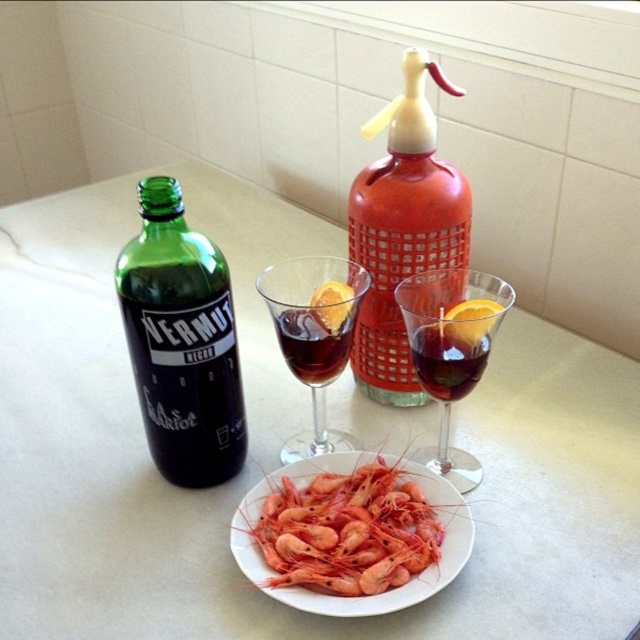
Between white glossy table at center and dark red glass at center, which one appears on the left side from the viewer's perspective?

Positioned to the left is white glossy table at center.

At what (x,y) coordinates should I click in order to perform the action: click on white glossy table at center. Please return your answer as a coordinate pair (x, y). This screenshot has height=640, width=640. Looking at the image, I should click on (278, 451).

The image size is (640, 640). Identify the location of white glossy table at center. (278, 451).

Does green glass bottle at left lie in front of dark red glass at center?

Yes.

Does green glass bottle at left have a greater width compared to dark red glass at center?

Yes.

The image size is (640, 640). I want to click on green glass bottle at left, so click(x=180, y=342).

Is white ceramic plate at center bigger than dark red glass at center?

Yes.

Can you confirm if white ceramic plate at center is positioned to the right of dark red glass at center?

No, white ceramic plate at center is not to the right of dark red glass at center.

Locate an element on the screen. white ceramic plate at center is located at coordinates (x=371, y=595).